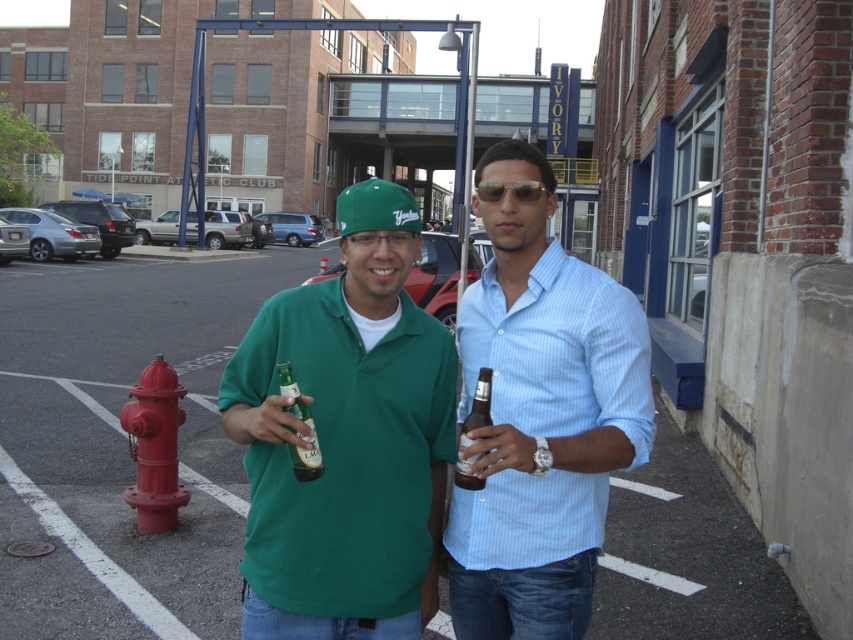
You are a photographer trying to capture a candid shot of the two people in the parking lot. You want to ensure the light blue striped shirt at center and the gold metallic sunglasses at center are both visible in the frame. Based on their positions, which object should you prioritize framing first to include both?

Since the light blue striped shirt at center is to the left of the gold metallic sunglasses at center, you should frame the light blue striped shirt at center first to ensure both are visible in the shot.

You are a photographer trying to capture a candid shot of the two people in the parking lot. You want to ensure that both the green matte shirt at center and the gold metallic sunglasses at center are in focus. Since you can only focus on one subject at a time, which object should you prioritize focusing on to ensure the other is also in focus?

The green matte shirt at center is closer to the viewer than the gold metallic sunglasses at center. By focusing on the closer object, the green matte shirt at center, the depth of field will likely include the gold metallic sunglasses at center as well, ensuring both are in focus.

You are designing a layout for a magazine cover and need to place two elements based on their sizes. You have the green matte shirt at center and the gold metallic sunglasses at center. Which object should you place first if you want to prioritize larger items?

The green matte shirt at center should be placed first because its width is larger than the gold metallic sunglasses at center, making it the larger object.